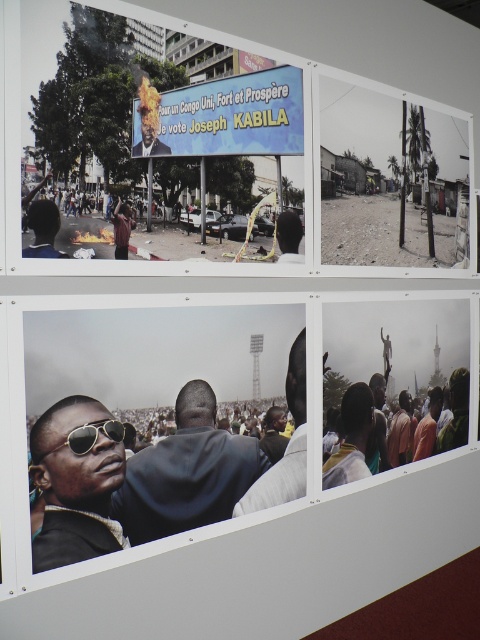
Is matte plastic billboard at upper center wider than matte black sunglasses at upper left?

Correct, the width of matte plastic billboard at upper center exceeds that of matte black sunglasses at upper left.

Who is more forward, (x=262, y=80) or (x=49, y=200)?

Point (x=49, y=200)

Locate an element on the screen. matte plastic billboard at upper center is located at coordinates (223, 116).

Who is more distant from viewer, (47, 420) or (268, 480)?

Point (268, 480)

Between sunglasses at lower left and matte black sunglasses at center, which one is positioned higher?

matte black sunglasses at center

This screenshot has height=640, width=480. I want to click on sunglasses at lower left, so click(76, 481).

Find the location of a particular element. The width and height of the screenshot is (480, 640). sunglasses at lower left is located at coordinates (76, 481).

Does point (92, 477) come in front of point (48, 228)?

No, it is not.

Is sunglasses at lower left to the right of matte black sunglasses at upper left from the viewer's perspective?

Correct, you'll find sunglasses at lower left to the right of matte black sunglasses at upper left.

Which is behind, point (64, 476) or point (57, 216)?

The point (64, 476) is more distant.

Identify the location of sunglasses at lower left. click(x=76, y=481).